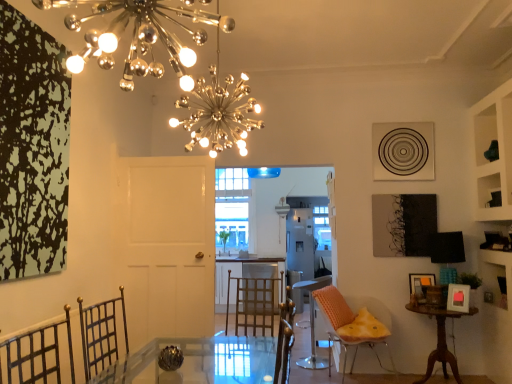
What is the approximate width of white matte door at center?

The width of white matte door at center is 16.34 centimeters.

Image resolution: width=512 pixels, height=384 pixels. What do you see at coordinates (165, 245) in the screenshot?
I see `white matte door at center` at bounding box center [165, 245].

The width and height of the screenshot is (512, 384). I want to click on satin white refrigerator at center, so click(x=300, y=244).

This screenshot has height=384, width=512. Describe the element at coordinates (440, 340) in the screenshot. I see `wooden round table at lower right` at that location.

The image size is (512, 384). I want to click on white matte door at center, so click(x=165, y=245).

From the image's perspective, is pink paper picture frame at lower right, which is the 1th picture frame in front-to-back order, on orange textured chair at right, arranged as the first chair when viewed from the front?

Yes, from the image's perspective, pink paper picture frame at lower right, which is the 1th picture frame in front-to-back order, is on top of orange textured chair at right, arranged as the first chair when viewed from the front.

Considering the relative sizes of pink paper picture frame at lower right, which is the 1th picture frame in front-to-back order, and orange textured chair at right, the second chair viewed from the back, in the image provided, is pink paper picture frame at lower right, which is the 1th picture frame in front-to-back order, shorter than orange textured chair at right, the second chair viewed from the back,?

Correct, pink paper picture frame at lower right, which is the 1th picture frame in front-to-back order, is not as tall as orange textured chair at right, the second chair viewed from the back.

Looking at this image, considering the relative sizes of pink paper picture frame at lower right, arranged as the second picture frame when viewed from the back, and orange textured chair at right, arranged as the first chair when viewed from the front, in the image provided, is pink paper picture frame at lower right, arranged as the second picture frame when viewed from the back, wider than orange textured chair at right, arranged as the first chair when viewed from the front,?

In fact, pink paper picture frame at lower right, arranged as the second picture frame when viewed from the back, might be narrower than orange textured chair at right, arranged as the first chair when viewed from the front.

Is pink paper picture frame at lower right, arranged as the second picture frame when viewed from the back, surrounding orange textured chair at right, arranged as the first chair when viewed from the front?

No, orange textured chair at right, arranged as the first chair when viewed from the front, is located outside of pink paper picture frame at lower right, arranged as the second picture frame when viewed from the back.

Considering the positions of point (193, 81) and point (312, 332), is point (193, 81) closer or farther from the camera than point (312, 332)?

Point (193, 81).

Is metallic spherical lights at upper center in front of or behind orange textured cushion at center, the second chair when ordered from front to back, in the image?

metallic spherical lights at upper center is positioned closer to the viewer than orange textured cushion at center, the second chair when ordered from front to back.

Find the location of a particular element. The width and height of the screenshot is (512, 384). chandelier on the left side of orange textured cushion at center, marked as the 1th chair in a back-to-front arrangement is located at coordinates (138, 36).

Considering the relative sizes of metallic spherical lights at upper center and orange textured cushion at center, marked as the 1th chair in a back-to-front arrangement, in the image provided, is metallic spherical lights at upper center taller than orange textured cushion at center, marked as the 1th chair in a back-to-front arrangement,?

No, metallic spherical lights at upper center is not taller than orange textured cushion at center, marked as the 1th chair in a back-to-front arrangement.

Find the location of a particular element. The width and height of the screenshot is (512, 384). door in front of the orange textured cushion at center, marked as the 1th chair in a back-to-front arrangement is located at coordinates (165, 245).

In the scene shown: From the image's perspective, is white matte door at center located above orange textured cushion at center, the second chair when ordered from front to back?

Yes.

Is white matte door at center looking in the opposite direction of orange textured cushion at center, the second chair when ordered from front to back?

white matte door at center is not turned away from orange textured cushion at center, the second chair when ordered from front to back.

Considering the sizes of objects white matte door at center and orange textured cushion at center, the second chair when ordered from front to back, in the image provided, who is bigger, white matte door at center or orange textured cushion at center, the second chair when ordered from front to back,?

Bigger between the two is white matte door at center.

Considering the positions of points (372, 344) and (322, 358), is point (372, 344) closer to camera compared to point (322, 358)?

Yes, point (372, 344) is closer to viewer.

Which object is positioned more to the left, orange textured chair at right, arranged as the first chair when viewed from the front, or orange textured cushion at center, the second chair when ordered from front to back?

Positioned to the left is orange textured cushion at center, the second chair when ordered from front to back.

How different are the orientations of orange textured chair at right, the second chair viewed from the back, and orange textured cushion at center, the second chair when ordered from front to back, in degrees?

orange textured chair at right, the second chair viewed from the back, and orange textured cushion at center, the second chair when ordered from front to back, are facing 117 degrees away from each other.

Is orange textured chair at right, arranged as the first chair when viewed from the front, shorter than orange textured cushion at center, the second chair when ordered from front to back?

Yes, orange textured chair at right, arranged as the first chair when viewed from the front, is shorter than orange textured cushion at center, the second chair when ordered from front to back.

Between satin white refrigerator at center and wooden round table at lower right, which one appears on the left side from the viewer's perspective?

Positioned to the left is satin white refrigerator at center.

Is satin white refrigerator at center oriented away from wooden round table at lower right?

No.

How far apart are satin white refrigerator at center and wooden round table at lower right?

satin white refrigerator at center is 2.18 meters from wooden round table at lower right.

The image size is (512, 384). I want to click on appliance located behind the wooden round table at lower right, so click(x=300, y=244).

Does satin white refrigerator at center turn towards orange textured cushion at center, marked as the 1th chair in a back-to-front arrangement?

No, satin white refrigerator at center does not turn towards orange textured cushion at center, marked as the 1th chair in a back-to-front arrangement.

At what (x,y) coordinates should I click in order to perform the action: click on appliance on the right side of orange textured cushion at center, the second chair when ordered from front to back. Please return your answer as a coordinate pair (x, y). Looking at the image, I should click on (300, 244).

From a real-world perspective, is satin white refrigerator at center on top of orange textured cushion at center, marked as the 1th chair in a back-to-front arrangement?

Yes, from a real-world perspective, satin white refrigerator at center is above orange textured cushion at center, marked as the 1th chair in a back-to-front arrangement.

Considering the sizes of objects satin white refrigerator at center and orange textured cushion at center, marked as the 1th chair in a back-to-front arrangement, in the image provided, who is thinner, satin white refrigerator at center or orange textured cushion at center, marked as the 1th chair in a back-to-front arrangement,?

orange textured cushion at center, marked as the 1th chair in a back-to-front arrangement, is thinner.

From a real-world perspective, is satin white refrigerator at center above or below clear glass window at center?

satin white refrigerator at center is below clear glass window at center.

Is satin white refrigerator at center oriented away from clear glass window at center?

No, satin white refrigerator at center's orientation is not away from clear glass window at center.

Which object is positioned more to the left, satin white refrigerator at center or clear glass window at center?

clear glass window at center is more to the left.

From the image's perspective, relative to clear glass window at center, is satin white refrigerator at center above or below?

satin white refrigerator at center is below clear glass window at center.

Find the location of a particular element. The image size is (512, 384). the 2nd picture frame to the right when counting from the orange textured chair at right, the second chair viewed from the back is located at coordinates (458, 298).

From the image's perspective, count 1st chairs downward from the metallic spherical lights at upper center and point to it. Please provide its 2D coordinates.

[(313, 323)]

Estimate the real-world distances between objects in this image. Which object is further from pink paper picture frame at lower right, arranged as the second picture frame when viewed from the back, orange textured chair at right, the second chair viewed from the back, or white matte door at center?

A: Based on the image, white matte door at center appears to be further to pink paper picture frame at lower right, arranged as the second picture frame when viewed from the back.

Considering their positions, is orange textured chair at right, arranged as the first chair when viewed from the front, positioned further to white matte door at center than orange textured cushion at center, marked as the 1th chair in a back-to-front arrangement?

orange textured cushion at center, marked as the 1th chair in a back-to-front arrangement, is further to white matte door at center.

From the picture: Looking at the image, which one is located closer to pink paper picture frame at lower right, which is the 1th picture frame in front-to-back order, wooden round table at lower right or orange textured cushion at center, marked as the 1th chair in a back-to-front arrangement?

wooden round table at lower right is closer to pink paper picture frame at lower right, which is the 1th picture frame in front-to-back order.

Estimate the real-world distances between objects in this image. Which object is further from orange textured chair at right, arranged as the first chair when viewed from the front, white matte door at center or pink paper picture frame at lower right, which is the 1th picture frame in front-to-back order?

white matte door at center is further to orange textured chair at right, arranged as the first chair when viewed from the front.

Estimate the real-world distances between objects in this image. Which object is closer to wooden round table at lower right, satin white refrigerator at center or pink paper picture frame at lower right, which is the 1th picture frame in front-to-back order?

The object closer to wooden round table at lower right is pink paper picture frame at lower right, which is the 1th picture frame in front-to-back order.

Based on the photo, from the image, which object appears to be nearer to wooden round table at lower right, wooden picture frame at lower right, positioned as the 2th picture frame in front-to-back order, or orange textured chair at right, the second chair viewed from the back?

wooden picture frame at lower right, positioned as the 2th picture frame in front-to-back order, lies closer to wooden round table at lower right than the other object.

Considering their positions, is wooden picture frame at lower right, positioned as the 2th picture frame in front-to-back order, positioned closer to orange textured cushion at center, the second chair when ordered from front to back, than orange textured chair at right, arranged as the first chair when viewed from the front?

orange textured chair at right, arranged as the first chair when viewed from the front, is closer to orange textured cushion at center, the second chair when ordered from front to back.

From the image, which object appears to be nearer to wooden picture frame at lower right, the first picture frame when ordered from back to front, orange textured chair at right, arranged as the first chair when viewed from the front, or metallic spherical lights at upper center?

orange textured chair at right, arranged as the first chair when viewed from the front, lies closer to wooden picture frame at lower right, the first picture frame when ordered from back to front, than the other object.

Find the location of a particular element. The image size is (512, 384). table between orange textured chair at right, arranged as the first chair when viewed from the front, and clear glass window at center in the front-back direction is located at coordinates (440, 340).

Where is `picture frame located between orange textured cushion at center, marked as the 1th chair in a back-to-front arrangement, and wooden round table at lower right in the left-right direction`? picture frame located between orange textured cushion at center, marked as the 1th chair in a back-to-front arrangement, and wooden round table at lower right in the left-right direction is located at coordinates (420, 284).

Identify the location of window located between pink paper picture frame at lower right, arranged as the second picture frame when viewed from the back, and satin white refrigerator at center in the depth direction. (232, 207).

I want to click on chair located between metallic spherical lights at upper center and pink paper picture frame at lower right, arranged as the second picture frame when viewed from the back, in the depth direction, so click(x=351, y=327).